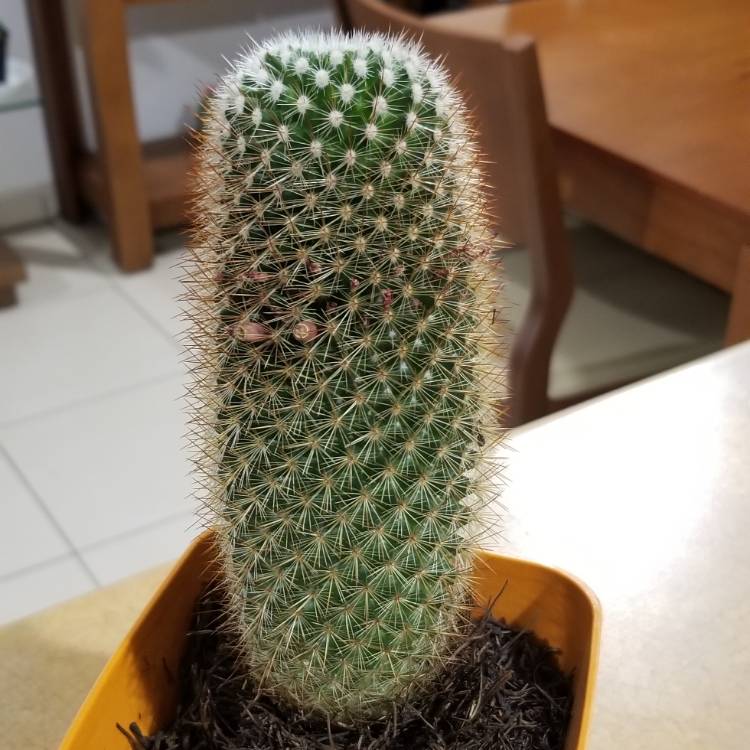
The height and width of the screenshot is (750, 750). I want to click on tables, so 94,58, 692,88.